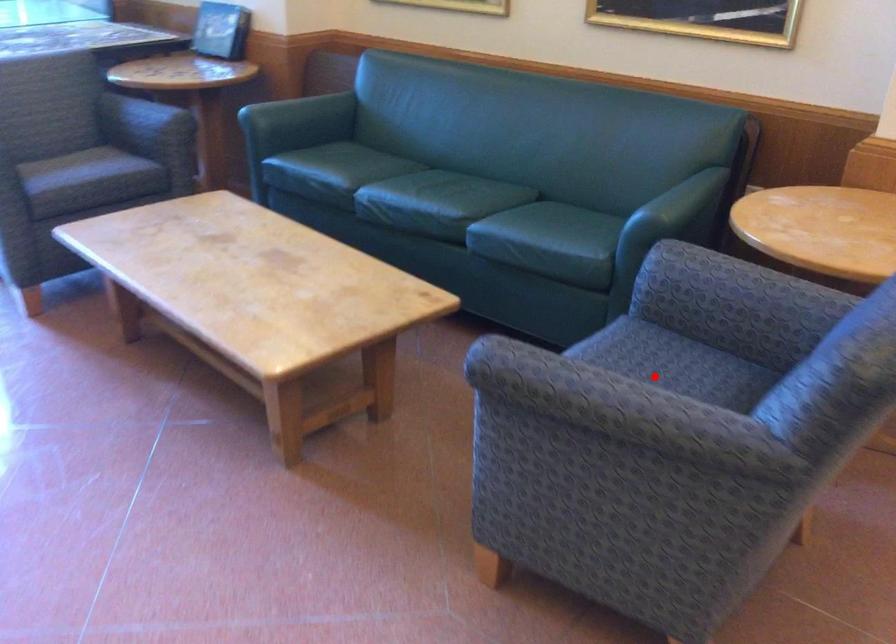
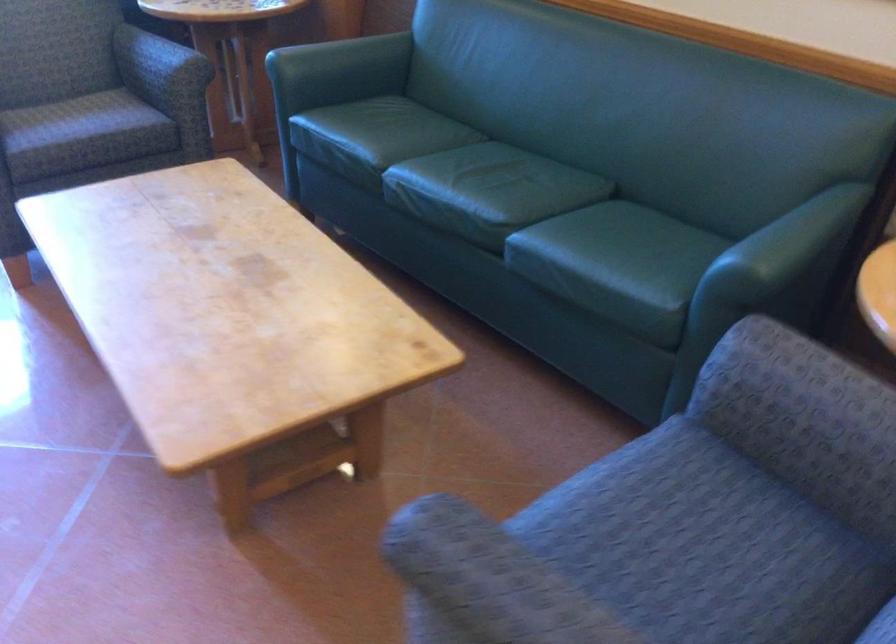
Where in the second image is the point corresponding to the highlighted location from the first image?

(690, 540)